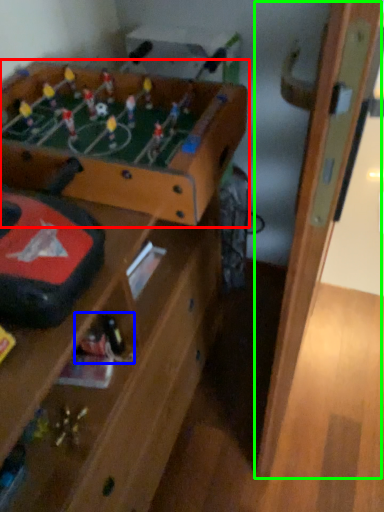
Question: Considering the real-world distances, which object is closest to table (highlighted by a red box)? toy (highlighted by a blue box) or door (highlighted by a green box).

Choices:
 (A) toy
 (B) door

Answer: (B)